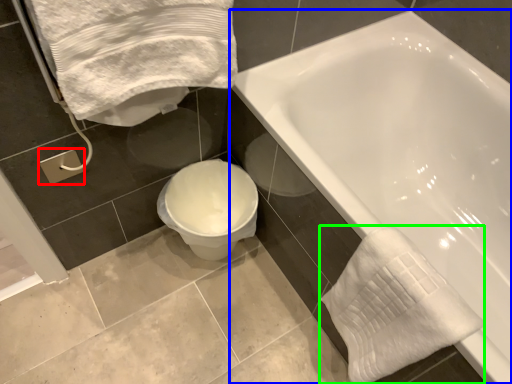
Question: Based on their relative distances, which object is nearer to towel bar (highlighted by a red box)? Choose from bathtub (highlighted by a blue box) and bath towel (highlighted by a green box).

Choices:
 (A) bathtub
 (B) bath towel

Answer: (B)